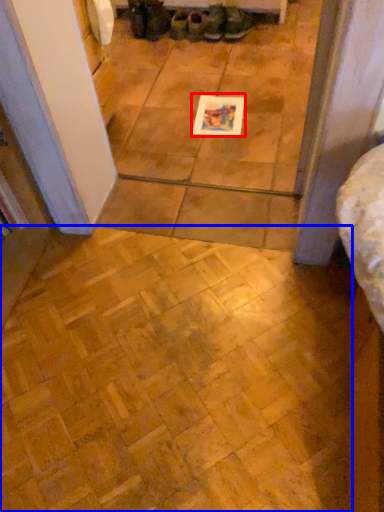
Question: Among these objects, which one is nearest to the camera, postcard (highlighted by a red box) or ceramic tile (highlighted by a blue box)?

Choices:
 (A) postcard
 (B) ceramic tile

Answer: (B)